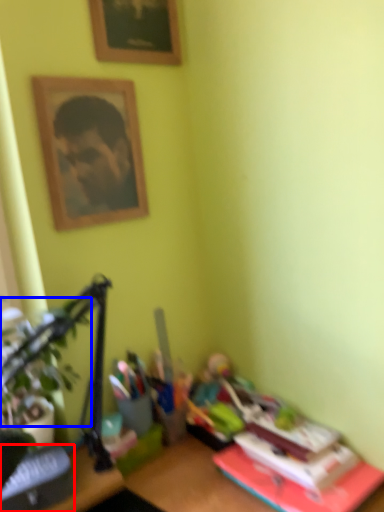
Question: Which point is closer to the camera, paperback book (highlighted by a red box) or plant (highlighted by a blue box)?

Choices:
 (A) paperback book
 (B) plant

Answer: (B)